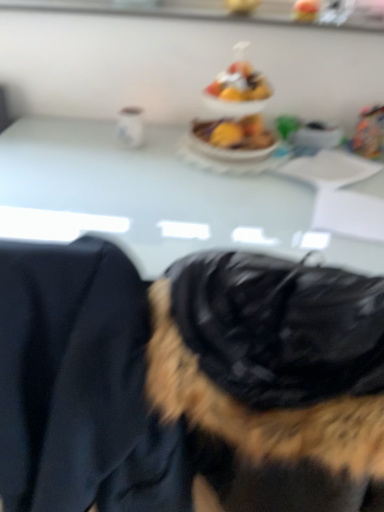
Question: Considering their positions, is white glossy table at center located in front of or behind shiny plastic fruit bowl at center?

Choices:
 (A) behind
 (B) front

Answer: (B)

Question: In terms of height, does white glossy table at center look taller or shorter compared to shiny plastic fruit bowl at center?

Choices:
 (A) short
 (B) tall

Answer: (B)

Question: Which object is the farthest from the black fur coat at center?

Choices:
 (A) white glossy table at center
 (B) shiny plastic fruit bowl at center

Answer: (B)

Question: Estimate the real-world distances between objects in this image. Which object is farther from the black fur coat at center?

Choices:
 (A) shiny plastic fruit bowl at center
 (B) white glossy table at center

Answer: (A)